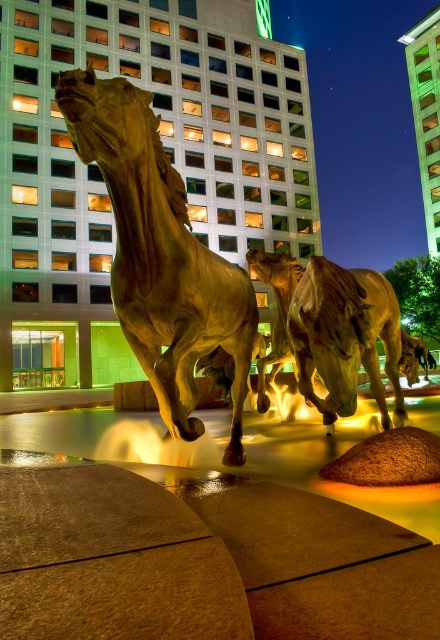
Can you confirm if gold polished horse at center is taller than shiny bronze horse at center?

Correct, gold polished horse at center is much taller as shiny bronze horse at center.

The image size is (440, 640). What do you see at coordinates (160, 253) in the screenshot? I see `gold polished horse at center` at bounding box center [160, 253].

I want to click on gold polished horse at center, so click(160, 253).